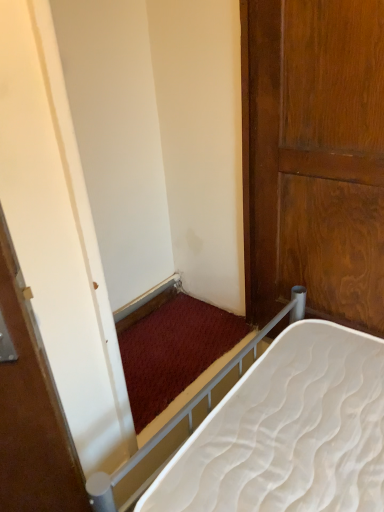
This screenshot has height=512, width=384. What do you see at coordinates (314, 157) in the screenshot?
I see `wooden door at right` at bounding box center [314, 157].

In order to click on wooden door at right in this screenshot , I will do `click(314, 157)`.

Measure the distance between point (x=296, y=185) and camera.

Point (x=296, y=185) and camera are 1.34 meters apart from each other.

This screenshot has height=512, width=384. I want to click on wooden door at right, so click(x=314, y=157).